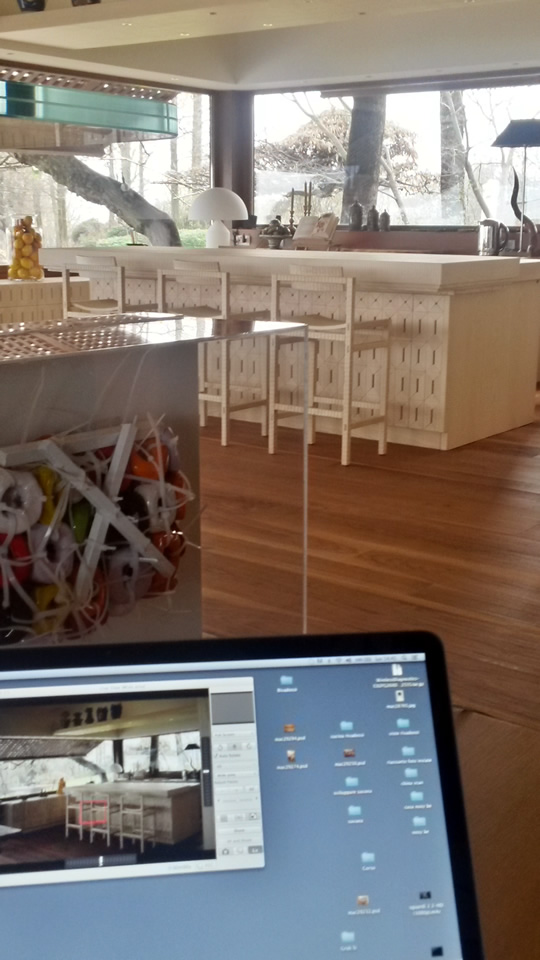
This screenshot has height=960, width=540. I want to click on task bar of the laptop, so click(x=383, y=655).